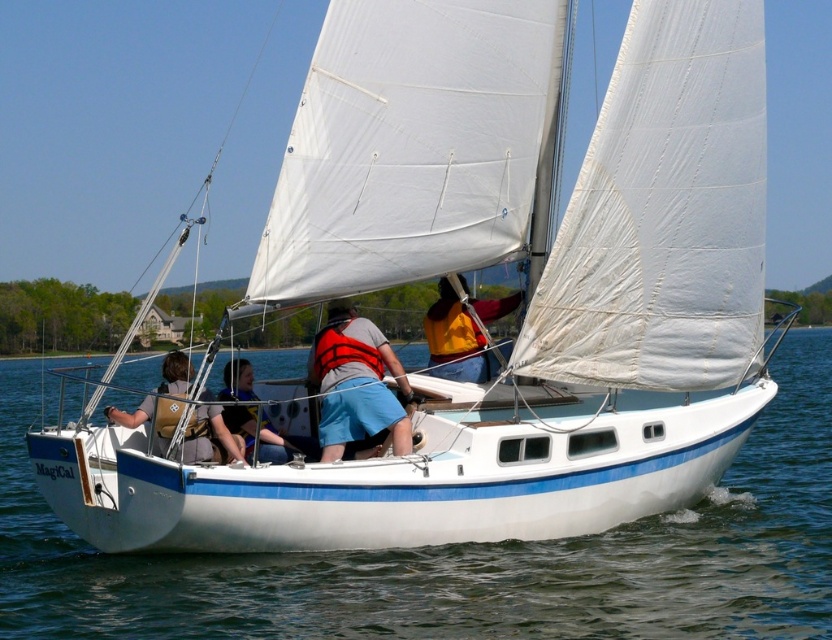
You are a passenger on the MagiCal sailboat and need to retrieve your life vest. Which life vest is closer to you, the orange life vest at center or the brown leather life vest at center?

The orange life vest at center is closer to you because it is further to the viewer than the brown leather life vest at center.